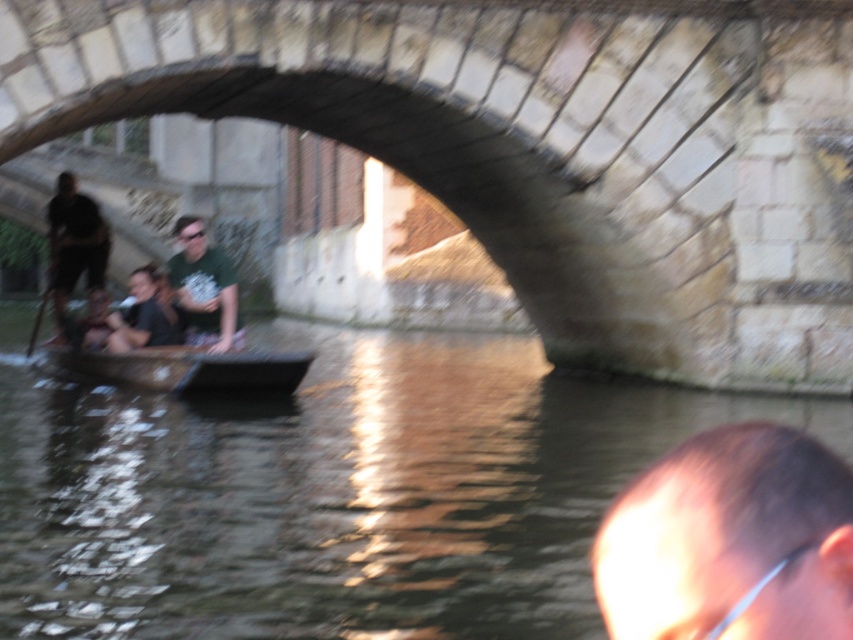
You are a photographer trying to capture a clear image of both the green matte shirt at center and the dark green shirt at center. Since you want both subjects to be visible, which shirt should you focus on to ensure the smaller one is in focus?

The dark green shirt at center is smaller than the green matte shirt at center. To ensure both are in focus, focus on the green matte shirt at center since it is larger and easier to target, but adjust the camera settings for a wider depth of field to include the smaller dark green shirt at center.

You are a photographer standing on the stone bridge and looking down at the two people in the boat below. You notice both the green matte shirt at center and the dark green shirt at center. Which person is standing closer to the front of the boat?

The green matte shirt at center is taller than the dark green shirt at center, so the person wearing the green matte shirt at center is likely standing closer to the front of the boat.